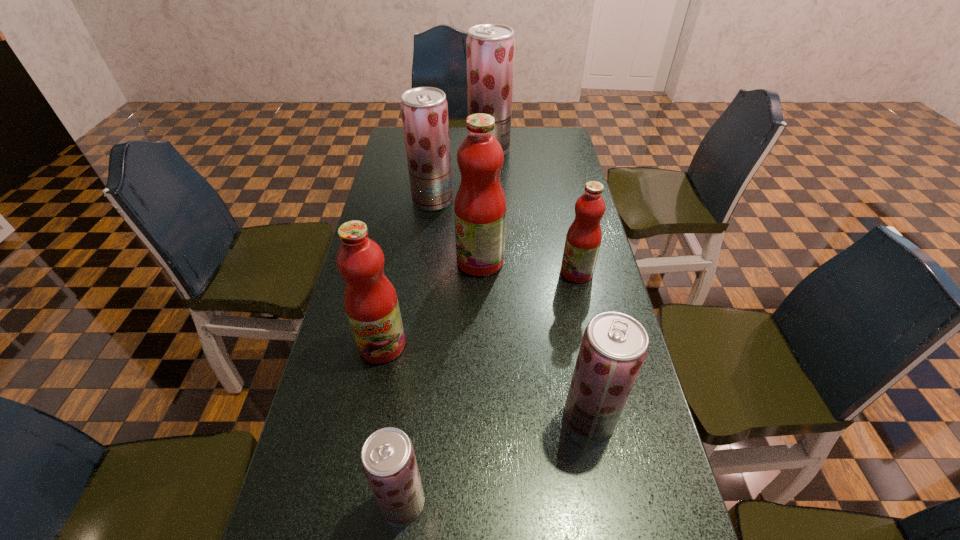
The height and width of the screenshot is (540, 960). In order to click on the nearest object in this screenshot , I will do `click(388, 459)`.

You are a GUI agent. You are given a task and a screenshot of the screen. Output one action in this format:
    pyautogui.click(x=<x>, y=<y>)
    Task: Click on the smallest strawberry fruit juice
    This screenshot has width=960, height=540.
    Given the screenshot: What is the action you would take?
    tap(388, 459)

At what (x,y) coordinates should I click in order to perform the action: click on free region located 0.270m on the front of the farthest object. Please return your answer as a coordinate pair (x, y). This screenshot has width=960, height=540. Looking at the image, I should click on (491, 201).

This screenshot has width=960, height=540. What are the coordinates of `free space located 0.220m on the front label of the second pink fruit juice from left to right` in the screenshot? It's located at (384, 261).

Find the location of a particular element. This screenshot has height=540, width=960. free location located on the front label of the second pink fruit juice from left to right is located at coordinates (394, 261).

The height and width of the screenshot is (540, 960). I want to click on vacant space located 0.200m on the front label of the second pink fruit juice from left to right, so click(x=391, y=261).

At what (x,y) coordinates should I click in order to perform the action: click on vacant space situated 0.060m on the front of the second farthest strawberry fruit juice. Please return your answer as a coordinate pair (x, y). This screenshot has height=540, width=960. Looking at the image, I should click on (430, 224).

Where is `vacant region located 0.100m on the front label of the second smallest pink fruit juice`? vacant region located 0.100m on the front label of the second smallest pink fruit juice is located at coordinates (372, 402).

Where is `vacant space situated on the front label of the smallest pink fruit juice`? The height and width of the screenshot is (540, 960). vacant space situated on the front label of the smallest pink fruit juice is located at coordinates (537, 272).

Identify the location of vacant space located 0.300m on the front label of the smallest pink fruit juice. Image resolution: width=960 pixels, height=540 pixels. (459, 272).